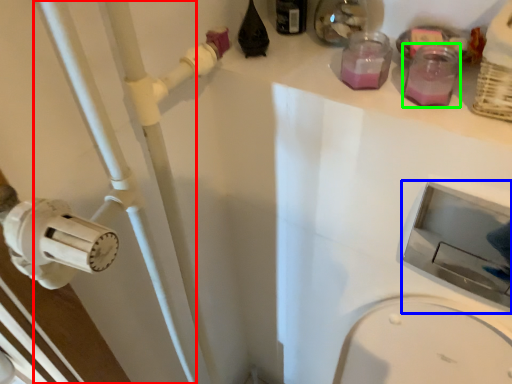
Question: Based on their relative distances, which object is farther from pipe (highlighted by a red box)? Choose from sink (highlighted by a blue box) and bottle (highlighted by a green box).

Choices:
 (A) sink
 (B) bottle

Answer: (A)